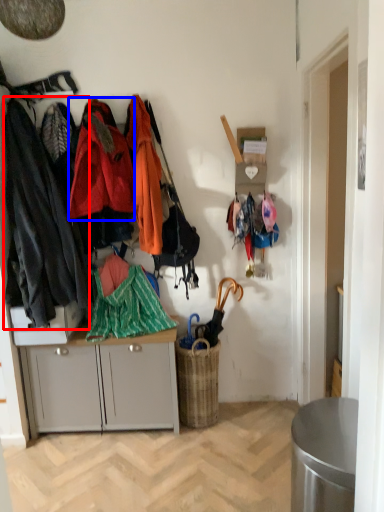
Question: Which of the following is the farthest to the observer, clothing (highlighted by a red box) or clothing (highlighted by a blue box)?

Choices:
 (A) clothing
 (B) clothing

Answer: (B)